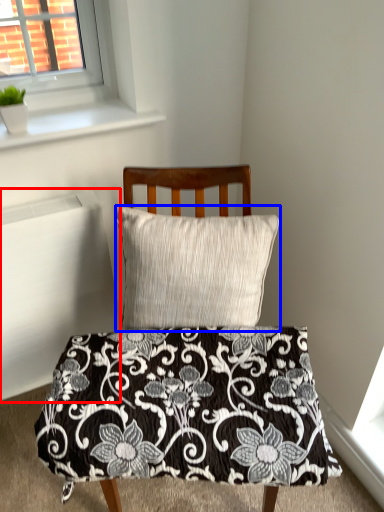
Question: Among these objects, which one is farthest to the camera, radiator (highlighted by a red box) or pillow (highlighted by a blue box)?

Choices:
 (A) radiator
 (B) pillow

Answer: (A)